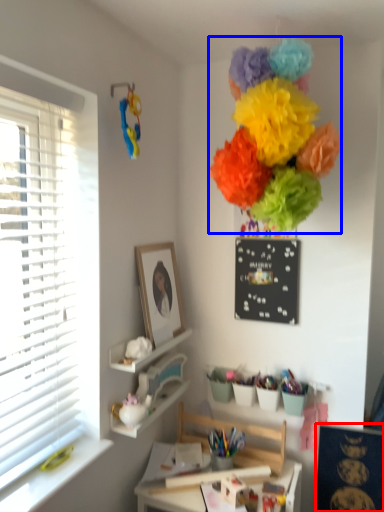
Question: Which of the following is the farthest to the observer, bulletin board (highlighted by a red box) or flower (highlighted by a blue box)?

Choices:
 (A) bulletin board
 (B) flower

Answer: (A)